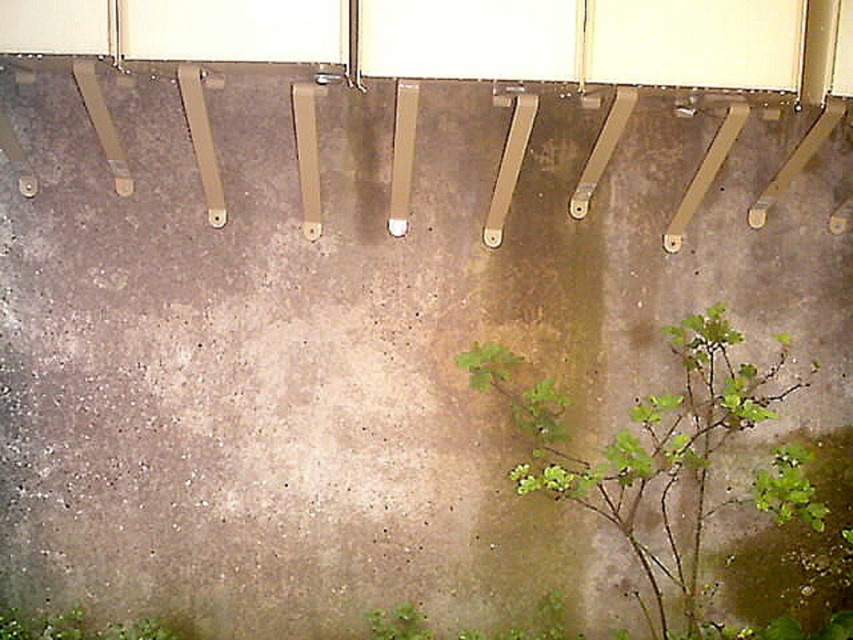
Question: Is green leafy plant at lower left to the right of green leafy plant at lower center from the viewer's perspective?

Choices:
 (A) no
 (B) yes

Answer: (A)

Question: Does green leafy plant at lower right come in front of green leafy plant at lower left?

Choices:
 (A) yes
 (B) no

Answer: (A)

Question: Estimate the real-world distances between objects in this image. Which object is farther from the green leafy plant at lower left?

Choices:
 (A) green leafy plant at lower center
 (B) green leafy plant at lower right

Answer: (B)

Question: Is green leafy plant at lower left above green leafy plant at lower center?

Choices:
 (A) yes
 (B) no

Answer: (B)

Question: Which point appears closest to the camera in this image?

Choices:
 (A) (421, 637)
 (B) (717, 436)

Answer: (A)

Question: Considering the real-world distances, which object is closest to the green leafy plant at lower center?

Choices:
 (A) green leafy plant at lower right
 (B) green leafy plant at lower left

Answer: (B)